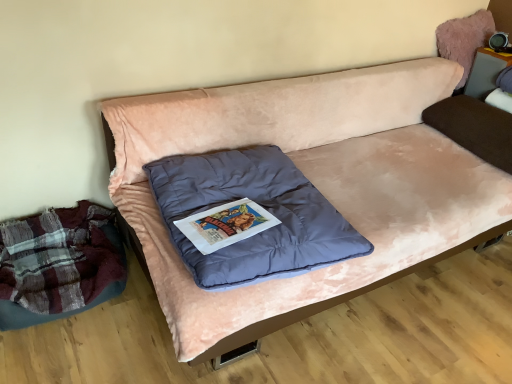
How much space does brown velvety pillow at right, arranged as the 1th pillow when viewed from the right, occupy vertically?

brown velvety pillow at right, arranged as the 1th pillow when viewed from the right, is 7.77 inches tall.

Where is `plaid fabric mattress at lower left`? The width and height of the screenshot is (512, 384). plaid fabric mattress at lower left is located at coordinates (59, 264).

What is the approximate width of plaid fabric mattress at lower left?

The width of plaid fabric mattress at lower left is 18.30 inches.

This screenshot has width=512, height=384. In order to click on matte gray speaker at upper right in this screenshot , I will do `click(485, 72)`.

The height and width of the screenshot is (384, 512). I want to click on fuzzy pink bean bag at upper right, so click(464, 40).

At what (x,y) coordinates should I click in order to perform the action: click on velvet blue pillow at center, marked as the second pillow in a back-to-front arrangement. Please return your answer as a coordinate pair (x, y). This screenshot has height=384, width=512. Looking at the image, I should click on (259, 204).

Considering the sizes of objects velvet pink couch at center and plaid fabric mattress at lower left in the image provided, who is smaller, velvet pink couch at center or plaid fabric mattress at lower left?

Smaller between the two is plaid fabric mattress at lower left.

How many degrees apart are the facing directions of velvet pink couch at center and plaid fabric mattress at lower left?

velvet pink couch at center and plaid fabric mattress at lower left are facing 2.41e-05 degrees away from each other.

Is velvet pink couch at center looking in the opposite direction of plaid fabric mattress at lower left?

No, velvet pink couch at center's orientation is not away from plaid fabric mattress at lower left.

Would you say velvet pink couch at center contains plaid fabric mattress at lower left?

No, plaid fabric mattress at lower left is not a part of velvet pink couch at center.

From a real-world perspective, is fuzzy pink bean bag at upper right physically below matte gray speaker at upper right?

Actually, fuzzy pink bean bag at upper right is physically above matte gray speaker at upper right in the real world.

Does fuzzy pink bean bag at upper right have a lesser width compared to matte gray speaker at upper right?

No, fuzzy pink bean bag at upper right is not thinner than matte gray speaker at upper right.

Where is `furniture that appears in front of the fuzzy pink bean bag at upper right`? Image resolution: width=512 pixels, height=384 pixels. furniture that appears in front of the fuzzy pink bean bag at upper right is located at coordinates (485, 72).

Does fuzzy pink bean bag at upper right have a lesser height compared to matte gray speaker at upper right?

Yes.

How many degrees apart are the facing directions of brown velvety pillow at right, the second pillow in the left-to-right sequence, and fuzzy pink bean bag at upper right?

There is a 90.3-degree angle between the facing directions of brown velvety pillow at right, the second pillow in the left-to-right sequence, and fuzzy pink bean bag at upper right.

Between brown velvety pillow at right, arranged as the 1th pillow when viewed from the right, and fuzzy pink bean bag at upper right, which one has smaller width?

Thinner between the two is fuzzy pink bean bag at upper right.

Identify the location of bean bag chair behind the brown velvety pillow at right, the second pillow in the left-to-right sequence. (464, 40).

Is brown velvety pillow at right, the second pillow in the left-to-right sequence, further to camera compared to fuzzy pink bean bag at upper right?

No, it is in front of fuzzy pink bean bag at upper right.

Do you think fuzzy pink bean bag at upper right is within velvet blue pillow at center, which ranks as the second pillow in right-to-left order, or outside of it?

fuzzy pink bean bag at upper right lies outside velvet blue pillow at center, which ranks as the second pillow in right-to-left order.

From a real-world perspective, between fuzzy pink bean bag at upper right and velvet blue pillow at center, which ranks as the second pillow in right-to-left order, who is vertically higher?

In real-world perspective, fuzzy pink bean bag at upper right is above.

Considering their positions, is fuzzy pink bean bag at upper right located in front of or behind velvet blue pillow at center, which ranks as the second pillow in right-to-left order?

Visually, fuzzy pink bean bag at upper right is located behind velvet blue pillow at center, which ranks as the second pillow in right-to-left order.

Considering the relative sizes of fuzzy pink bean bag at upper right and velvet blue pillow at center, arranged as the first pillow when viewed from the front, in the image provided, is fuzzy pink bean bag at upper right taller than velvet blue pillow at center, arranged as the first pillow when viewed from the front,?

Yes.

Is velvet blue pillow at center, which ranks as the second pillow in right-to-left order, far away from brown velvety pillow at right, acting as the second pillow starting from the front?

velvet blue pillow at center, which ranks as the second pillow in right-to-left order, is far away from brown velvety pillow at right, acting as the second pillow starting from the front.

Can you tell me how much velvet blue pillow at center, which ranks as the first pillow in left-to-right order, and brown velvety pillow at right, the second pillow in the left-to-right sequence, differ in facing direction?

They differ by 2.85 degrees in their facing directions.

From a real-world perspective, is velvet blue pillow at center, which ranks as the second pillow in right-to-left order, physically below brown velvety pillow at right, acting as the second pillow starting from the front?

Yes, from a real-world perspective, velvet blue pillow at center, which ranks as the second pillow in right-to-left order, is below brown velvety pillow at right, acting as the second pillow starting from the front.

Is velvet blue pillow at center, which ranks as the second pillow in right-to-left order, looking in the opposite direction of brown velvety pillow at right, the first pillow when ordered from back to front?

No, velvet blue pillow at center, which ranks as the second pillow in right-to-left order, is not facing the opposite direction of brown velvety pillow at right, the first pillow when ordered from back to front.

From a real-world perspective, between matte gray speaker at upper right and velvet pink couch at center, who is vertically lower?

From a 3D spatial view, velvet pink couch at center is below.

How different are the orientations of matte gray speaker at upper right and velvet pink couch at center in degrees?

There is a 90.3-degree angle between the facing directions of matte gray speaker at upper right and velvet pink couch at center.

Is matte gray speaker at upper right facing away from velvet pink couch at center?

That's not correct — matte gray speaker at upper right is not looking away from velvet pink couch at center.

Considering the sizes of objects matte gray speaker at upper right and velvet pink couch at center in the image provided, who is bigger, matte gray speaker at upper right or velvet pink couch at center?

Bigger between the two is velvet pink couch at center.

At what (x,y) coordinates should I click in order to perform the action: click on the 1st pillow behind the velvet pink couch at center, starting your count from the anchor. Please return your answer as a coordinate pair (x, y). Looking at the image, I should click on (259, 204).

In the scene shown: Which is behind, velvet blue pillow at center, which ranks as the second pillow in right-to-left order, or velvet pink couch at center?

velvet blue pillow at center, which ranks as the second pillow in right-to-left order, is further from the camera.

Between point (266, 230) and point (190, 128), which one is positioned behind?

The point (190, 128) is farther.

Identify the location of mattress behind the velvet pink couch at center. (59, 264).

At what (x,y) coordinates should I click in order to perform the action: click on furniture in front of the fuzzy pink bean bag at upper right. Please return your answer as a coordinate pair (x, y). Looking at the image, I should click on (485, 72).

Looking at the image, which one is located closer to plaid fabric mattress at lower left, velvet blue pillow at center, which ranks as the second pillow in right-to-left order, or fuzzy pink bean bag at upper right?

velvet blue pillow at center, which ranks as the second pillow in right-to-left order.

From the image, which object appears to be farther from matte gray speaker at upper right, plaid fabric mattress at lower left or brown velvety pillow at right, the second pillow in the left-to-right sequence?

Among the two, plaid fabric mattress at lower left is located further to matte gray speaker at upper right.

Which object lies further to the anchor point plaid fabric mattress at lower left, velvet blue pillow at center, arranged as the first pillow when viewed from the front, or matte gray speaker at upper right?

matte gray speaker at upper right is positioned further to the anchor plaid fabric mattress at lower left.

From the image, which object appears to be farther from matte gray speaker at upper right, plaid fabric mattress at lower left or fuzzy pink bean bag at upper right?

plaid fabric mattress at lower left is further to matte gray speaker at upper right.

Looking at the image, which one is located further to velvet blue pillow at center, which ranks as the second pillow in right-to-left order, velvet pink couch at center or fuzzy pink bean bag at upper right?

fuzzy pink bean bag at upper right.

Which object lies nearer to the anchor point velvet pink couch at center, brown velvety pillow at right, acting as the second pillow starting from the front, or plaid fabric mattress at lower left?

brown velvety pillow at right, acting as the second pillow starting from the front, lies closer to velvet pink couch at center than the other object.

Which object lies further to the anchor point velvet pink couch at center, fuzzy pink bean bag at upper right or velvet blue pillow at center, marked as the second pillow in a back-to-front arrangement?

fuzzy pink bean bag at upper right is positioned further to the anchor velvet pink couch at center.

Estimate the real-world distances between objects in this image. Which object is closer to velvet blue pillow at center, which ranks as the second pillow in right-to-left order, brown velvety pillow at right, acting as the second pillow starting from the front, or plaid fabric mattress at lower left?

plaid fabric mattress at lower left lies closer to velvet blue pillow at center, which ranks as the second pillow in right-to-left order, than the other object.

Where is `pillow situated between plaid fabric mattress at lower left and velvet pink couch at center from left to right`? This screenshot has width=512, height=384. pillow situated between plaid fabric mattress at lower left and velvet pink couch at center from left to right is located at coordinates (259, 204).

The width and height of the screenshot is (512, 384). Identify the location of studio couch situated between plaid fabric mattress at lower left and brown velvety pillow at right, the first pillow when ordered from back to front, from left to right. (315, 185).

Locate an element on the screen. The width and height of the screenshot is (512, 384). furniture located between velvet pink couch at center and fuzzy pink bean bag at upper right in the depth direction is located at coordinates (485, 72).

Identify the location of bean bag chair between plaid fabric mattress at lower left and matte gray speaker at upper right from left to right. (464, 40).